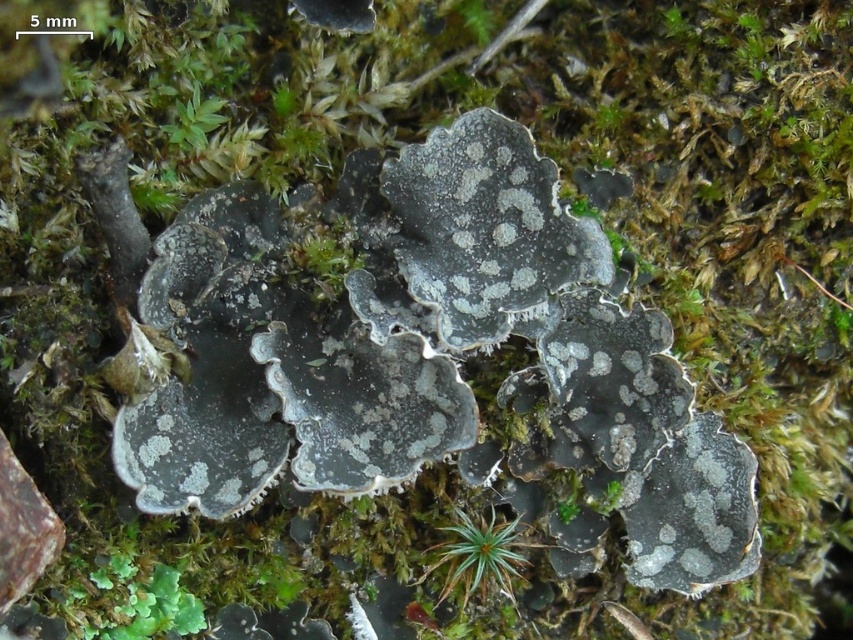
Question: Can you confirm if green leafy plant at lower left is positioned to the right of green fuzzy moss at center?

Choices:
 (A) yes
 (B) no

Answer: (B)

Question: Can you confirm if green leafy plant at lower left is positioned above green fuzzy moss at center?

Choices:
 (A) no
 (B) yes

Answer: (A)

Question: Which object appears farthest from the camera in this image?

Choices:
 (A) green fuzzy moss at center
 (B) green leafy plant at lower left

Answer: (A)

Question: Observing the image, what is the correct spatial positioning of green leafy plant at lower left in reference to green fuzzy moss at center?

Choices:
 (A) left
 (B) right

Answer: (A)